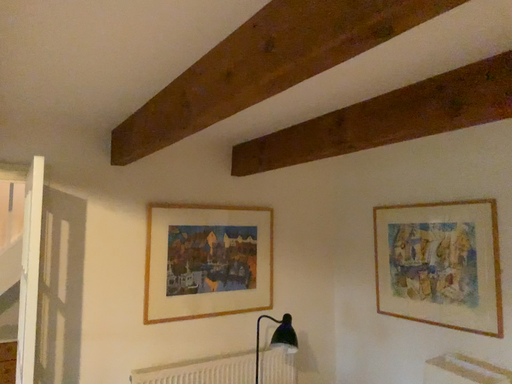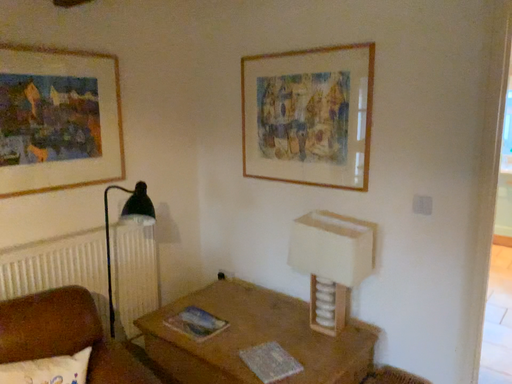
Question: How did the camera likely rotate when shooting the video?

Choices:
 (A) rotated upward
 (B) rotated downward

Answer: (B)